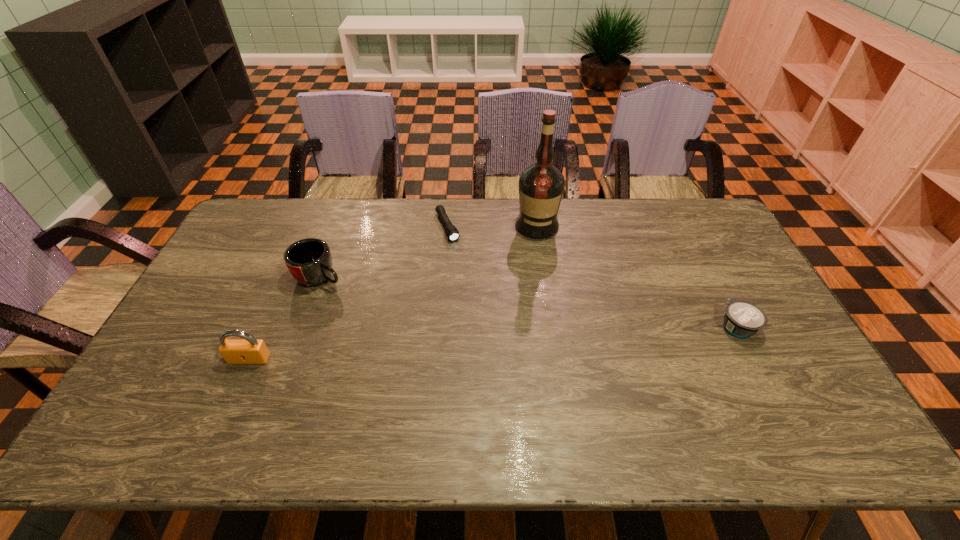
Locate an element on the screen. This screenshot has width=960, height=540. vacant space that satisfies the following two spatial constraints: 1. on the front side of the flashlight; 2. on the right side of the fourth farthest object is located at coordinates (440, 327).

You are a GUI agent. You are given a task and a screenshot of the screen. Output one action in this format:
    pyautogui.click(x=<x>, y=<y>)
    Task: Click on the vacant space that satisfies the following two spatial constraints: 1. on the front side of the flashlight; 2. on the right side of the rightmost object
    This screenshot has width=960, height=540.
    Given the screenshot: What is the action you would take?
    pyautogui.click(x=440, y=327)